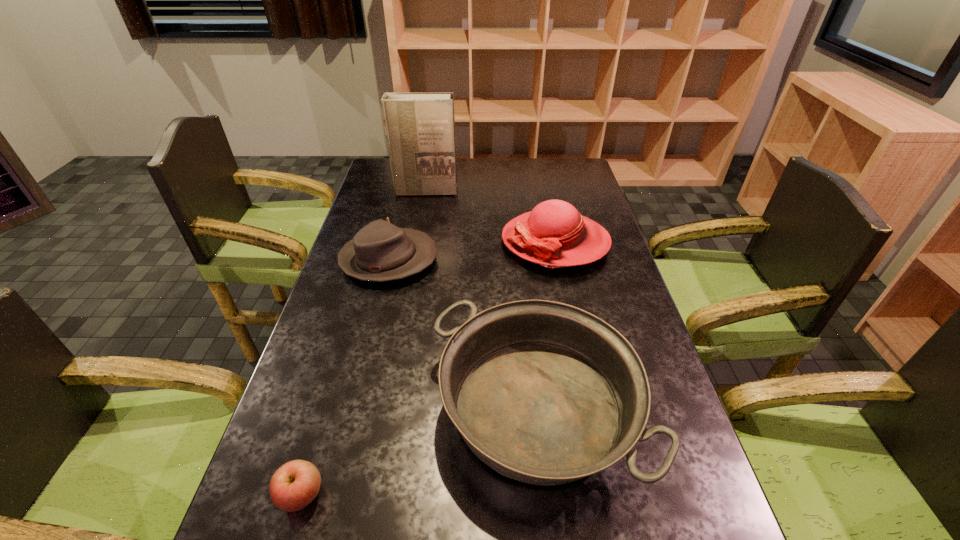
Locate an element on the screen. phonebook is located at coordinates (420, 127).

You are a GUI agent. You are given a task and a screenshot of the screen. Output one action in this format:
    pyautogui.click(x=<x>, y=<y>)
    Task: Click on the farthest object
    
    Given the screenshot: What is the action you would take?
    pyautogui.click(x=420, y=127)

This screenshot has width=960, height=540. I want to click on the taller hat, so click(x=554, y=234).

The height and width of the screenshot is (540, 960). What are the coordinates of `pan` in the screenshot? It's located at (545, 393).

You are a GUI agent. You are given a task and a screenshot of the screen. Output one action in this format:
    pyautogui.click(x=<x>, y=<y>)
    Task: Click on the left hat
    The width and height of the screenshot is (960, 540).
    Given the screenshot: What is the action you would take?
    pyautogui.click(x=380, y=251)

You are a GUI agent. You are given a task and a screenshot of the screen. Output one action in this format:
    pyautogui.click(x=<x>, y=<y>)
    Task: Click on the shorter hat
    The width and height of the screenshot is (960, 540).
    Given the screenshot: What is the action you would take?
    pyautogui.click(x=380, y=251)

Where is `apple`? This screenshot has height=540, width=960. apple is located at coordinates coord(294,485).

In order to click on free location located on the cover of the phonebook in this screenshot , I will do (415, 251).

Where is `vacant position located 0.390m at the front of the right hat with a bow`? This screenshot has width=960, height=540. vacant position located 0.390m at the front of the right hat with a bow is located at coordinates (381, 242).

Locate an element on the screen. This screenshot has height=540, width=960. vacant space located 0.250m at the front of the right hat with a bow is located at coordinates (424, 242).